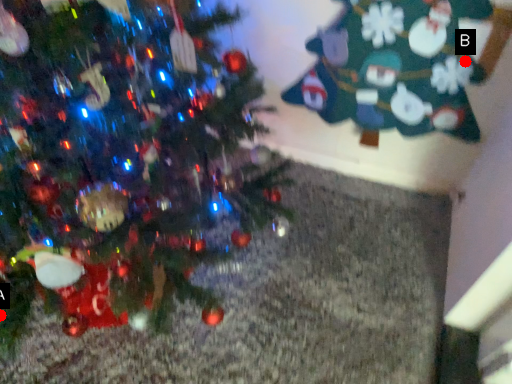
Question: Two points are circled on the image, labeled by A and B beside each circle. Which point is closer to the camera?

Choices:
 (A) A is closer
 (B) B is closer

Answer: (A)